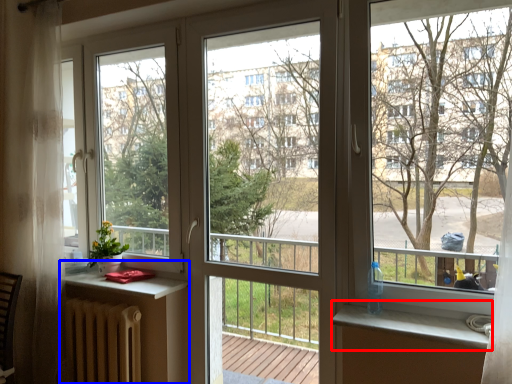
Question: Which object appears closest to the camera in this image, window sill (highlighted by a red box) or table (highlighted by a blue box)?

Choices:
 (A) window sill
 (B) table

Answer: (A)